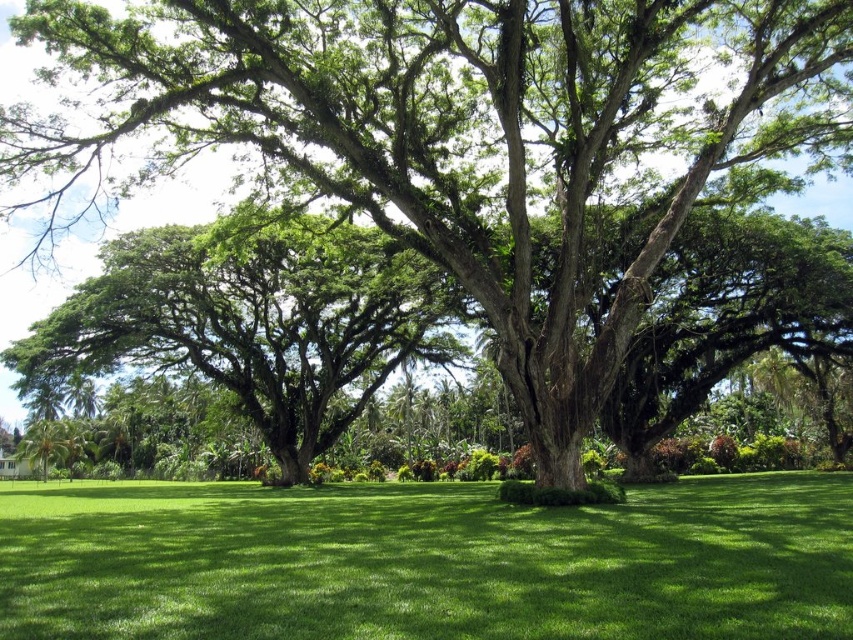
Is point (149, 625) behind point (434, 336)?

No, it is in front of (434, 336).

Between point (512, 624) and point (105, 296), which one is positioned behind?

The point (105, 296) is more distant.

Locate an element on the screen. green grass at center is located at coordinates (427, 563).